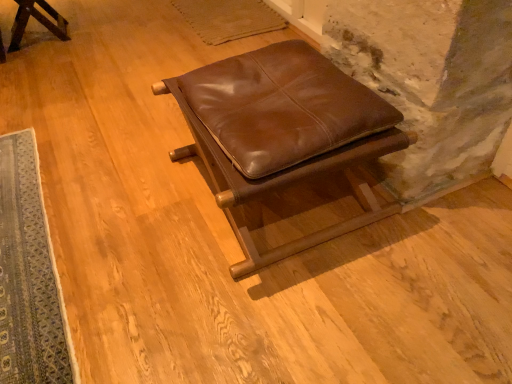
What are the coordinates of `free location to the left of brown leather ottoman at center, which appears as the first furniture when viewed from the front` in the screenshot? It's located at (114, 204).